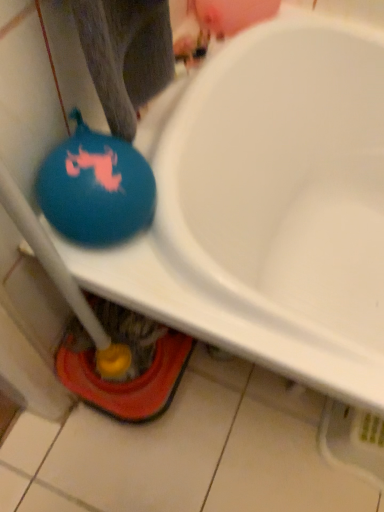
Describe the element at coordinates (96, 188) in the screenshot. I see `blue rubber balloon at left` at that location.

At what (x,y) coordinates should I click in order to perform the action: click on blue rubber balloon at left. Please return your answer as a coordinate pair (x, y). The height and width of the screenshot is (512, 384). Looking at the image, I should click on (96, 188).

Image resolution: width=384 pixels, height=512 pixels. Find the location of `blue rubber balloon at left`. blue rubber balloon at left is located at coordinates coord(96,188).